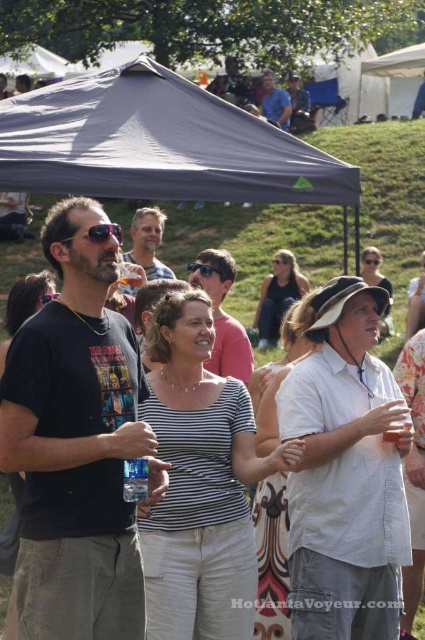
You are a photographer at the event and want to capture a clear photo of the white cotton shirt at center and the matte black sunglasses at center. If the camera can only focus on objects within a 15 cm width, will both items fit in the frame?

The white cotton shirt at center might be wider than matte black sunglasses at center. However, since the camera can focus on objects within a 15 cm width, both items should fit as long as their combined width does not exceed 15 cm. The exact fit depends on their individual widths, but the description only states a possible width comparison, not exact measurements.

You are a photographer trying to capture a clear photo of the matte black sunglasses at center without any obstructions. Given the white canvas tent at upper center is in the way, can you adjust your position to take the shot?

The matte black sunglasses at center is behind the white canvas tent at upper center, so moving your position to the side or angle your camera around the tent might allow you to capture the sunglasses without obstruction.

You are at the outdoor gathering and want to know which structure is taller between the dark gray fabric canopy at upper center and the white canvas tent at upper center. Can you determine this based on their positions?

The dark gray fabric canopy at upper center is taller than the white canvas tent at upper center.